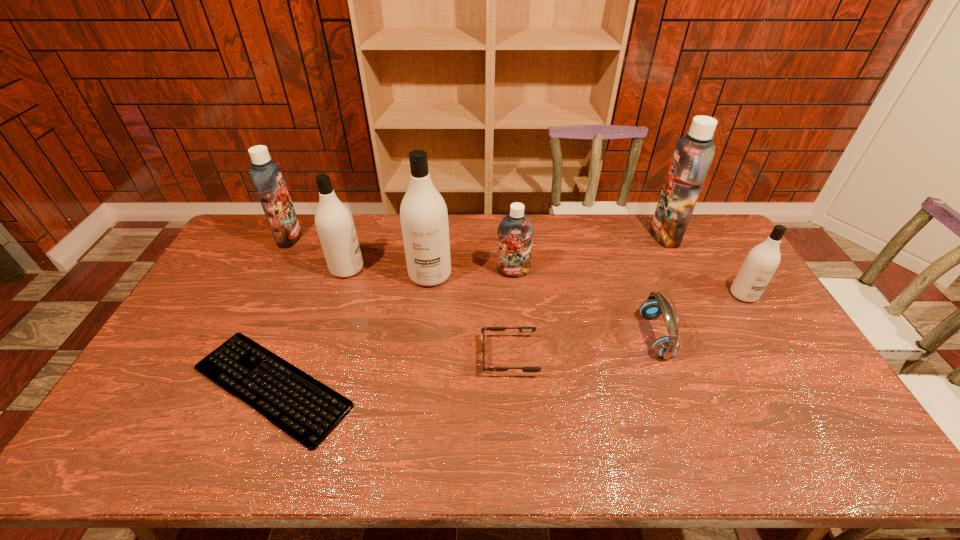
Where is `vacant space situated on the temples of the sunglasses`? Image resolution: width=960 pixels, height=540 pixels. vacant space situated on the temples of the sunglasses is located at coordinates (344, 356).

At what (x,y) coordinates should I click in order to perform the action: click on free location located 0.150m on the back of the black computer keyboard. Please return your answer as a coordinate pair (x, y). Looking at the image, I should click on (307, 299).

Find the location of a particular element. object present at the near edge is located at coordinates (305, 409).

Identify the location of shampoo that is at the left edge. (266, 175).

Find the location of a particular element. computer keyboard located in the left edge section of the desktop is located at coordinates (305, 409).

Identify the location of object that is at the far left corner. (266, 175).

Where is `object located at the near left corner`? The height and width of the screenshot is (540, 960). object located at the near left corner is located at coordinates (305, 409).

The image size is (960, 540). I want to click on object at the far right corner, so click(693, 155).

This screenshot has width=960, height=540. I want to click on vacant space at the far edge, so click(388, 248).

The width and height of the screenshot is (960, 540). Find the location of `vacant space at the near edge of the desktop`. vacant space at the near edge of the desktop is located at coordinates click(x=365, y=462).